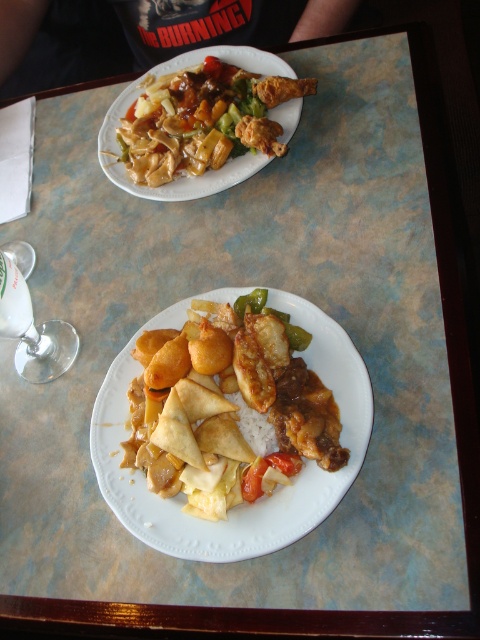
You are a food critic evaluating the presentation of the meal. Based on the image, which item is positioned higher up on the plate between the shiny brown chicken at upper left and the green glossy bell pepper at center?

The shiny brown chicken at upper left is positioned higher up on the plate compared to the green glossy bell pepper at center, as it is located above it.

You are a food critic analyzing the composition of the meal on the table. Where is the white matte rice at center located in terms of coordinates?

The white matte rice at center is located at coordinates point (253,426).